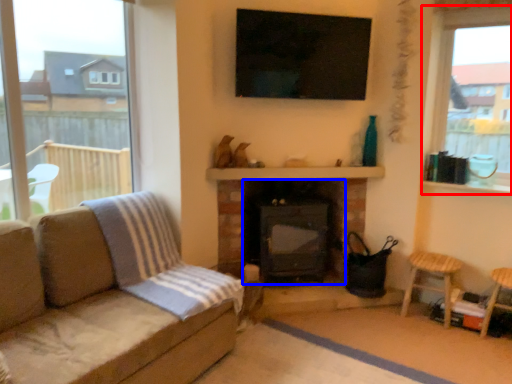
Question: Which of the following is the closest to the observer, window (highlighted by a red box) or fireplace (highlighted by a blue box)?

Choices:
 (A) window
 (B) fireplace

Answer: (A)